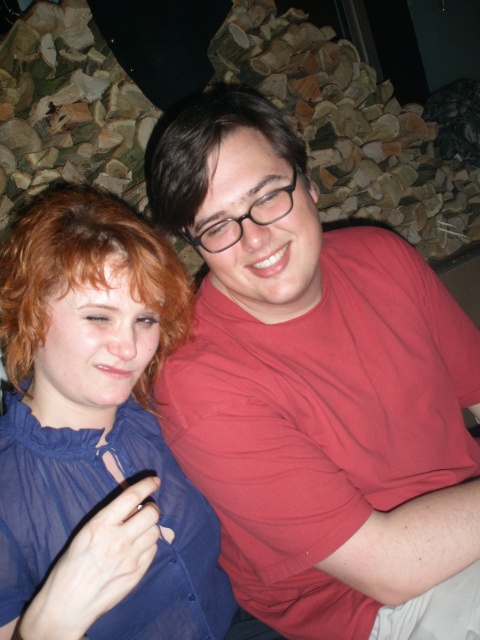
Which is below, matte red shirt at center or reddish brown curly hair at left?

matte red shirt at center is below.

Which is in front, point (407, 381) or point (179, 337)?

Point (179, 337)

Is point (320, 280) positioned in front of point (167, 339)?

Yes.

Find the location of a particular element. This screenshot has width=480, height=640. matte red shirt at center is located at coordinates (317, 392).

Does point (162, 294) come in front of point (153, 148)?

Yes, point (162, 294) is closer to viewer.

Does blue satin blouse at upper left have a larger size compared to dark brown hair at center?

Yes.

Where is `blue satin blouse at upper left`? This screenshot has height=640, width=480. blue satin blouse at upper left is located at coordinates (97, 410).

Is blue satin blouse at upper left above reddish brown curly hair at left?

Incorrect, blue satin blouse at upper left is not positioned above reddish brown curly hair at left.

Is blue satin blouse at upper left bigger than reddish brown curly hair at left?

Indeed, blue satin blouse at upper left has a larger size compared to reddish brown curly hair at left.

Find the location of a particular element. The image size is (480, 640). blue satin blouse at upper left is located at coordinates (97, 410).

Where is `blue satin blouse at upper left`? Image resolution: width=480 pixels, height=640 pixels. blue satin blouse at upper left is located at coordinates (97, 410).